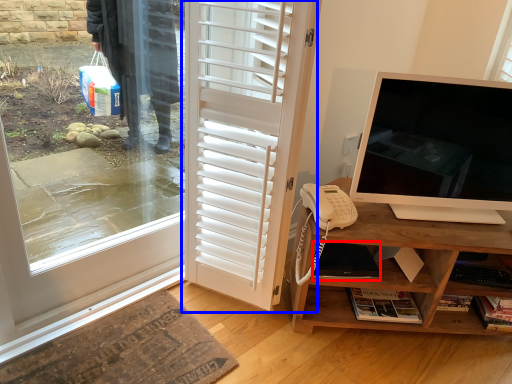
Question: Which of the following is the farthest to the observer, laptop (highlighted by a red box) or door (highlighted by a blue box)?

Choices:
 (A) laptop
 (B) door

Answer: (A)